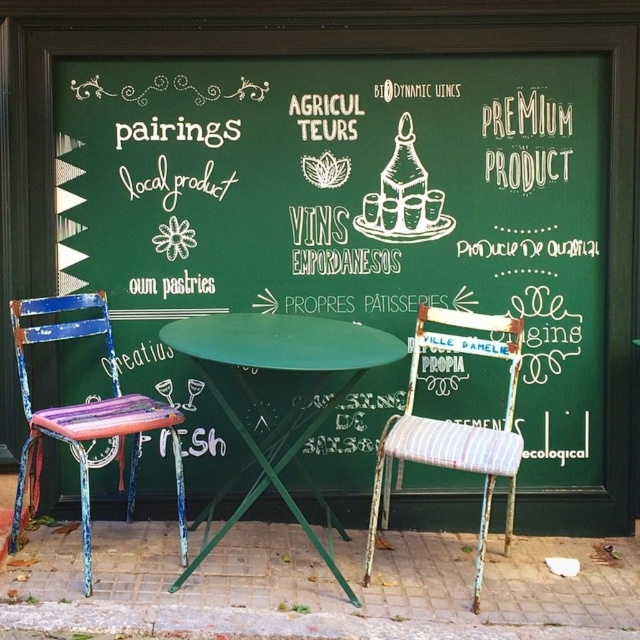
You are a customer looking to sit down at the green metal table at center. There is a distressed wood chair at left nearby. Can you determine if the chair will fit comfortably next to the table without being too cramped?

The green metal table at center is wider than the distressed wood chair at left, so there should be enough space for the chair to fit comfortably next to the table without being too cramped.

What is located at the coordinates point (358, 204)?

The green chalkboard at center is located at point (358, 204).